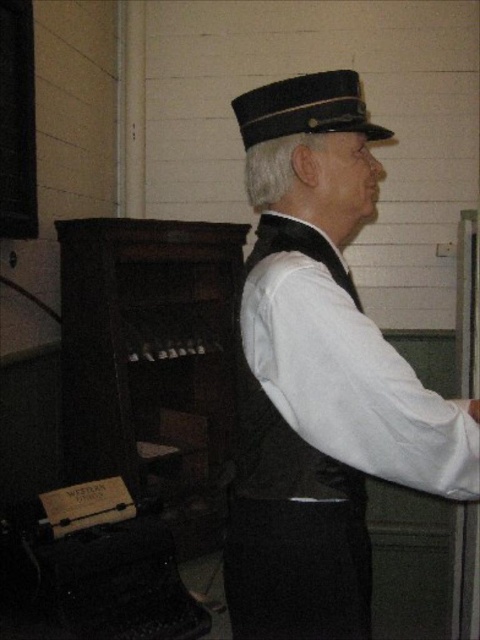
You are standing in front of the image. There is a point at coordinates (x=320, y=376). What object is located at that point?

The point at coordinates (x=320, y=376) indicates the black matte uniform at center.

You are a tailor measuring a mannequin wearing the black matte uniform at center and the black felt hat at upper center. Which item requires a longer vertical measurement for its fabric?

The black matte uniform at center requires a longer vertical measurement for its fabric since it is much taller than the black felt hat at upper center.